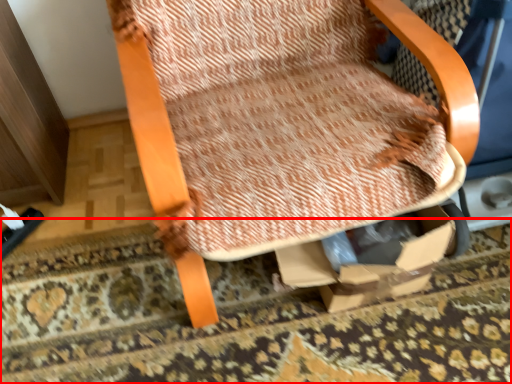
Question: From the image's perspective, where is mat (annotated by the red box) located in relation to chair in the image?

Choices:
 (A) below
 (B) above

Answer: (A)